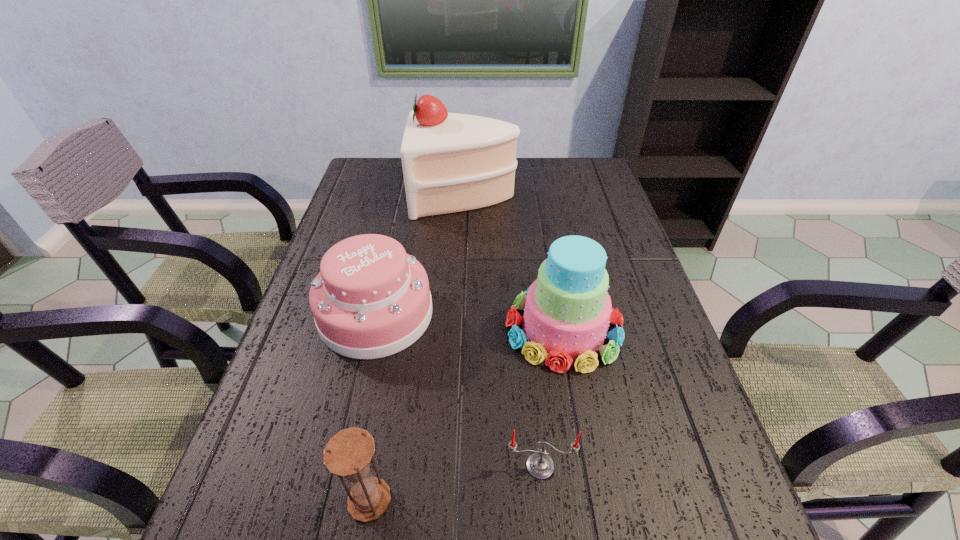
I want to click on free point between the farthest cake and the candle, so click(x=502, y=330).

The width and height of the screenshot is (960, 540). I want to click on free area in between the fourth shortest object and the tallest object, so click(515, 262).

The height and width of the screenshot is (540, 960). Find the location of `empty location between the hourglass and the tallest object`. empty location between the hourglass and the tallest object is located at coordinates (418, 348).

The image size is (960, 540). Find the location of `vacant space that is in between the second shortest cake and the hourglass`. vacant space that is in between the second shortest cake and the hourglass is located at coordinates (467, 414).

The height and width of the screenshot is (540, 960). I want to click on vacant region between the hourglass and the shortest object, so click(455, 483).

The height and width of the screenshot is (540, 960). Identify the location of unoccupied area between the tallest cake and the shortest cake. (420, 255).

The image size is (960, 540). I want to click on free space between the shortest object and the second shortest cake, so click(x=552, y=397).

Identify which object is the fourth nearest to the second shortest cake. Please provide its 2D coordinates. Your answer should be formatted as a tuple, i.e. [(x, y)], where the tuple contains the x and y coordinates of a point satisfying the conditions above.

[(348, 454)]

Select which object is the closest to the shortest cake. Please provide its 2D coordinates. Your answer should be formatted as a tuple, i.e. [(x, y)], where the tuple contains the x and y coordinates of a point satisfying the conditions above.

[(567, 310)]

Identify the location of the second closest cake relative to the hourglass. (567, 310).